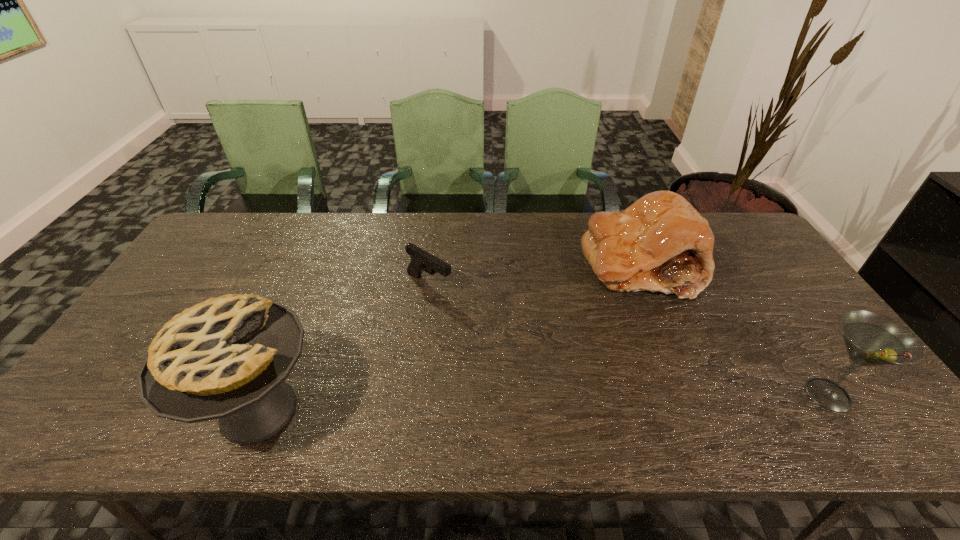
In the image, there is a desktop. What are the coordinates of `vacant space at the right edge` in the screenshot? It's located at (776, 305).

Where is `free region at the far left corner of the desktop`? The height and width of the screenshot is (540, 960). free region at the far left corner of the desktop is located at coordinates (251, 235).

At what (x,y) coordinates should I click in order to perform the action: click on vacant space at the far right corner of the desktop. Please return your answer as a coordinate pair (x, y). The image size is (960, 540). Looking at the image, I should click on (733, 217).

Identify the location of empty space that is in between the second object from right to left and the pistol. Image resolution: width=960 pixels, height=540 pixels. (535, 274).

This screenshot has height=540, width=960. Find the location of `empty space between the pie and the pistol`. empty space between the pie and the pistol is located at coordinates (x=344, y=347).

You are a GUI agent. You are given a task and a screenshot of the screen. Output one action in this format:
    pyautogui.click(x=<x>, y=<y>)
    Task: Click on the unoccupied position between the martini and the bread
    The height and width of the screenshot is (540, 960).
    Given the screenshot: What is the action you would take?
    pyautogui.click(x=734, y=330)

You are a GUI agent. You are given a task and a screenshot of the screen. Output one action in this format:
    pyautogui.click(x=<x>, y=<y>)
    Task: Click on the free spot between the pistol and the bread
    The image size is (960, 540).
    Given the screenshot: What is the action you would take?
    pyautogui.click(x=535, y=274)

Where is `free space between the martini and the bread`? This screenshot has width=960, height=540. free space between the martini and the bread is located at coordinates (734, 330).

The width and height of the screenshot is (960, 540). What are the coordinates of `free area in between the second object from left to right and the leftmost object` in the screenshot? It's located at (344, 347).

Find the location of a particular element. This screenshot has height=540, width=960. empty space between the rightmost object and the leftmost object is located at coordinates (543, 403).